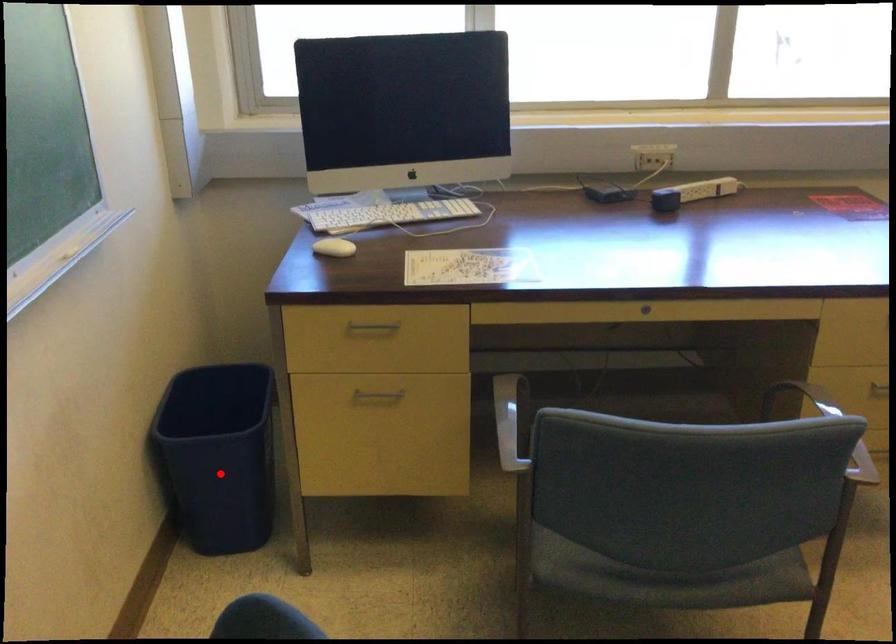
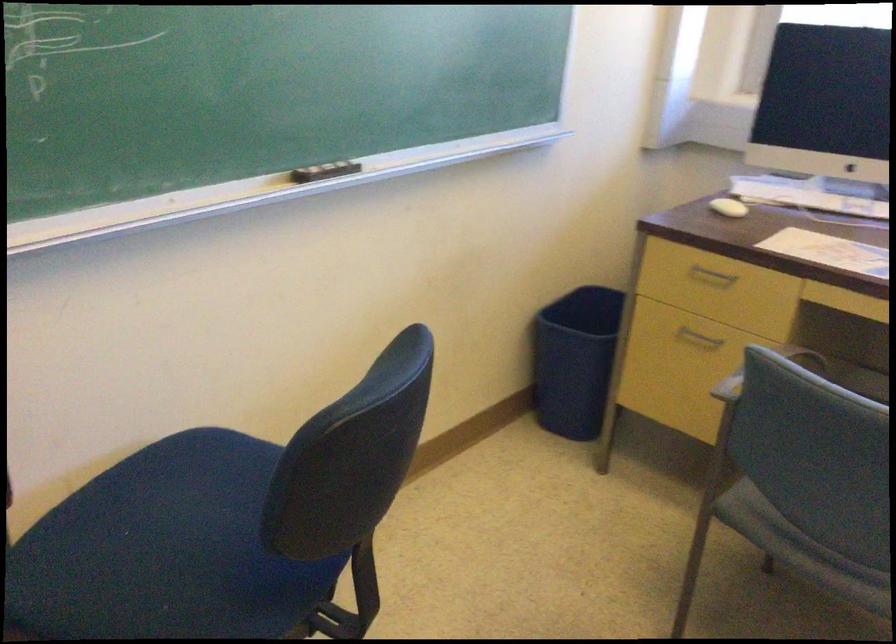
Question: I am providing you with two images of the same scene from different viewpoints. In image1, a red point is highlighted. Considering the same 3D point in image2, which of the following is correct?

Choices:
 (A) It is closer
 (B) It is farther

Answer: (B)